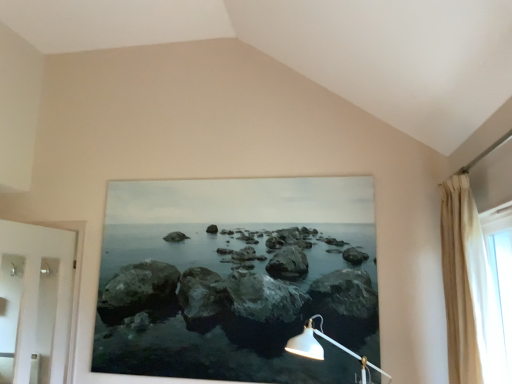
Question: Would you say translucent fabric curtain at right is outside white glossy door at left?

Choices:
 (A) yes
 (B) no

Answer: (A)

Question: Considering the relative positions of translucent fabric curtain at right and white glossy door at left in the image provided, is translucent fabric curtain at right to the left of white glossy door at left from the viewer's perspective?

Choices:
 (A) yes
 (B) no

Answer: (B)

Question: Does translucent fabric curtain at right touch white glossy door at left?

Choices:
 (A) no
 (B) yes

Answer: (A)

Question: Considering the relative positions of translucent fabric curtain at right and white glossy door at left in the image provided, is translucent fabric curtain at right behind white glossy door at left?

Choices:
 (A) no
 (B) yes

Answer: (A)

Question: From the image's perspective, does translucent fabric curtain at right appear higher than white glossy door at left?

Choices:
 (A) no
 (B) yes

Answer: (B)

Question: Does point (494, 243) appear closer or farther from the camera than point (476, 244)?

Choices:
 (A) closer
 (B) farther

Answer: (B)

Question: Considering the positions of translucent fabric curtain at right and beige fabric curtain at right in the image, is translucent fabric curtain at right bigger or smaller than beige fabric curtain at right?

Choices:
 (A) big
 (B) small

Answer: (B)

Question: In the image, is translucent fabric curtain at right on the left side or the right side of beige fabric curtain at right?

Choices:
 (A) left
 (B) right

Answer: (B)

Question: Is translucent fabric curtain at right situated inside beige fabric curtain at right or outside?

Choices:
 (A) outside
 (B) inside

Answer: (A)

Question: Visually, is beige fabric curtain at right positioned to the left or to the right of white glossy door at left?

Choices:
 (A) left
 (B) right

Answer: (B)

Question: Is beige fabric curtain at right in front of or behind white glossy door at left in the image?

Choices:
 (A) front
 (B) behind

Answer: (A)

Question: In terms of size, does beige fabric curtain at right appear bigger or smaller than white glossy door at left?

Choices:
 (A) small
 (B) big

Answer: (A)

Question: Do you think beige fabric curtain at right is within white glossy door at left, or outside of it?

Choices:
 (A) outside
 (B) inside

Answer: (A)

Question: Is white glossy door at left taller or shorter than translucent fabric curtain at right?

Choices:
 (A) short
 (B) tall

Answer: (B)

Question: Considering their positions, is white glossy door at left located in front of or behind translucent fabric curtain at right?

Choices:
 (A) front
 (B) behind

Answer: (B)